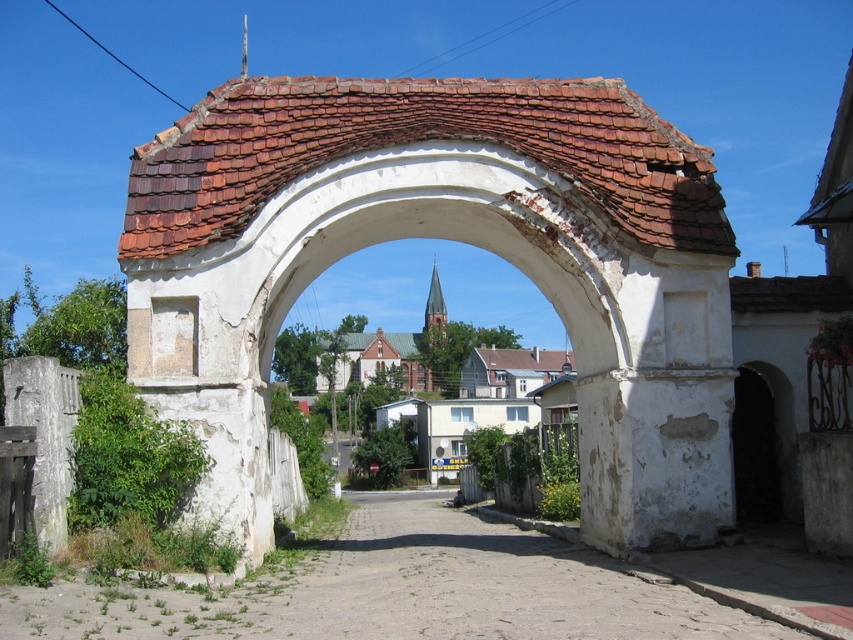
You are standing at the entrance of the archway and want to take a photo of the gray concrete gate at left and the dirt road at center. Which object is positioned to the right side of the other?

The dirt road at center is to the right of gray concrete gate at left.

You are standing in front of the stone archway and notice two points marked on the archway. The first point is at coordinates point (42, 618) and the second point is at point (39, 483). Which of these two points is closer to you?

Point (42, 618) is closer to the viewer than point (39, 483).